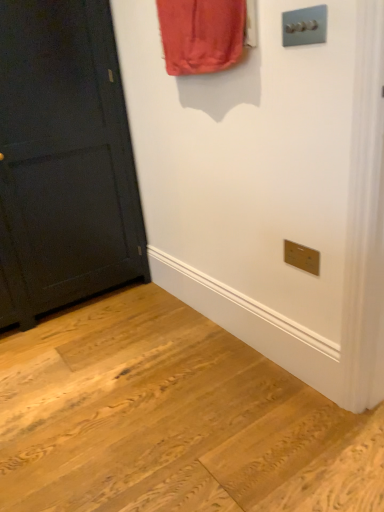
Question: Is matte black door at left thinner than satin silver light switch at upper right?

Choices:
 (A) no
 (B) yes

Answer: (A)

Question: Is satin silver light switch at upper right at the back of matte black door at left?

Choices:
 (A) no
 (B) yes

Answer: (A)

Question: Considering the relative positions of matte black door at left and satin silver light switch at upper right in the image provided, is matte black door at left behind satin silver light switch at upper right?

Choices:
 (A) no
 (B) yes

Answer: (B)

Question: Does matte black door at left turn towards satin silver light switch at upper right?

Choices:
 (A) yes
 (B) no

Answer: (A)

Question: Is matte black door at left next to satin silver light switch at upper right and touching it?

Choices:
 (A) yes
 (B) no

Answer: (B)

Question: Is matte black door at left at the right side of satin silver light switch at upper right?

Choices:
 (A) no
 (B) yes

Answer: (A)

Question: From the image's perspective, is satin silver light switch at upper right located beneath matte black door at left?

Choices:
 (A) yes
 (B) no

Answer: (B)

Question: Is satin silver light switch at upper right wider than matte black door at left?

Choices:
 (A) yes
 (B) no

Answer: (B)

Question: Is satin silver light switch at upper right at the right side of matte black door at left?

Choices:
 (A) no
 (B) yes

Answer: (B)

Question: From a real-world perspective, is satin silver light switch at upper right on top of matte black door at left?

Choices:
 (A) yes
 (B) no

Answer: (A)

Question: Is the depth of satin silver light switch at upper right less than that of matte black door at left?

Choices:
 (A) yes
 (B) no

Answer: (A)

Question: Considering the relative sizes of satin silver light switch at upper right and matte black door at left in the image provided, is satin silver light switch at upper right smaller than matte black door at left?

Choices:
 (A) yes
 (B) no

Answer: (A)

Question: Relative to satin silver light switch at upper right, is matte black door at left in front or behind?

Choices:
 (A) behind
 (B) front

Answer: (A)